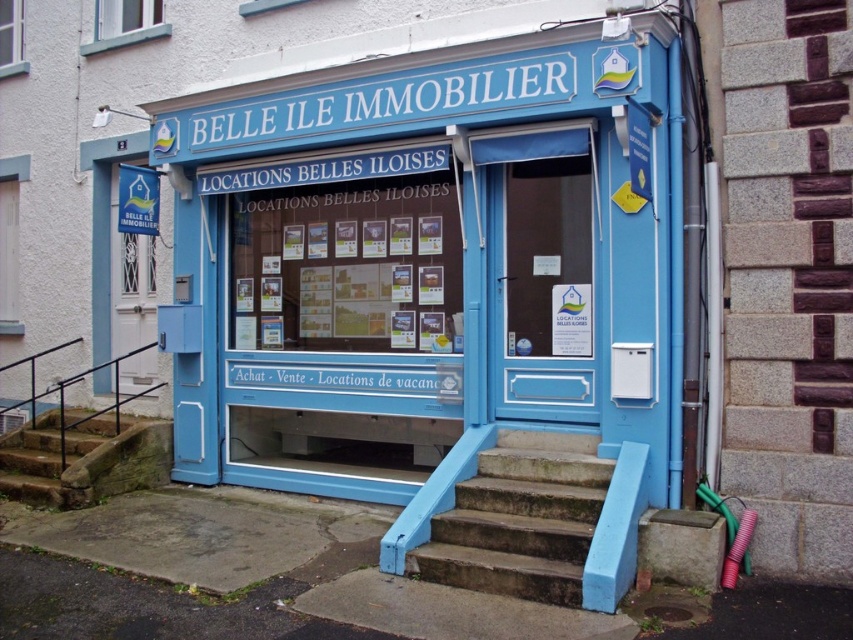
Does point (543, 266) come closer to viewer compared to point (430, 573)?

That is False.

Can you confirm if blue painted wood storefront at center is positioned above concrete stairs at center?

Indeed, blue painted wood storefront at center is positioned over concrete stairs at center.

Who is more forward, (643, 422) or (514, 566)?

Point (514, 566) is more forward.

The height and width of the screenshot is (640, 853). What are the coordinates of `blue painted wood storefront at center` in the screenshot? It's located at click(428, 262).

This screenshot has width=853, height=640. Find the location of `blue painted wood storefront at center`. blue painted wood storefront at center is located at coordinates (428, 262).

Does blue painted wood storefront at center have a greater height compared to white paper posters at center?

Correct, blue painted wood storefront at center is much taller as white paper posters at center.

What do you see at coordinates (428, 262) in the screenshot? I see `blue painted wood storefront at center` at bounding box center [428, 262].

Where is `blue painted wood storefront at center`? blue painted wood storefront at center is located at coordinates (428, 262).

Based on the photo, is blue painted wood storefront at center further to camera compared to stone textured stairs at lower left?

No, it is not.

Which is more to the left, blue painted wood storefront at center or stone textured stairs at lower left?

stone textured stairs at lower left

Identify the location of blue painted wood storefront at center. (428, 262).